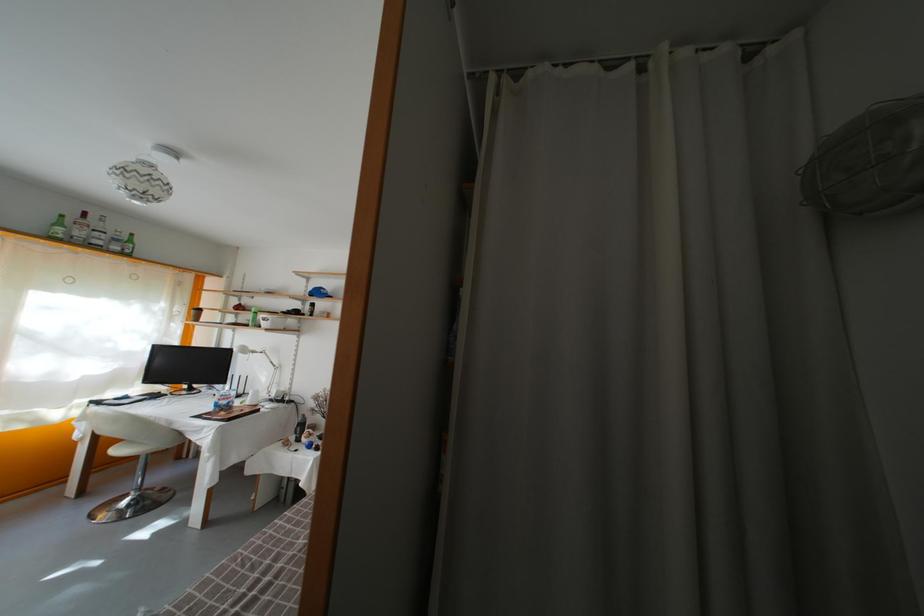
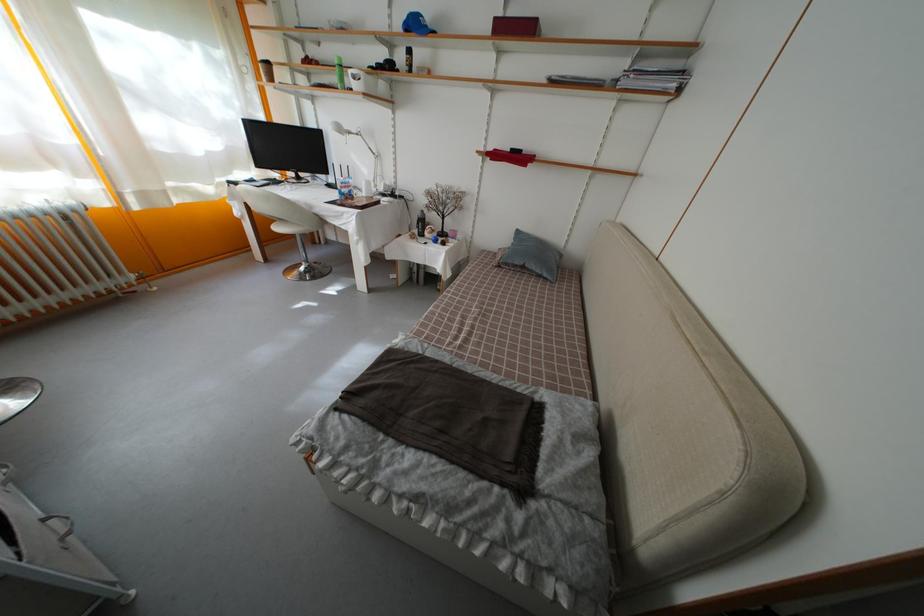
Question: How did the camera likely rotate?

Choices:
 (A) Left
 (B) Right
 (C) Up
 (D) Down

Answer: (D)